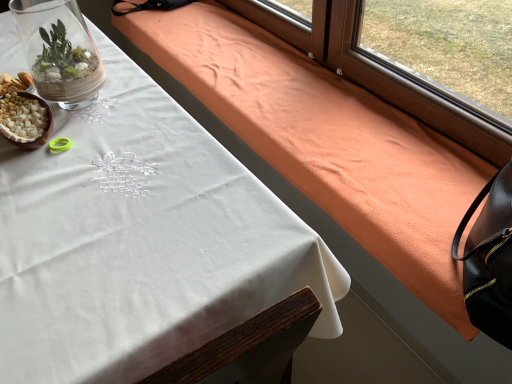
Identify the location of free spot in front of white matte bowl at lower left. The width and height of the screenshot is (512, 384). (35, 177).